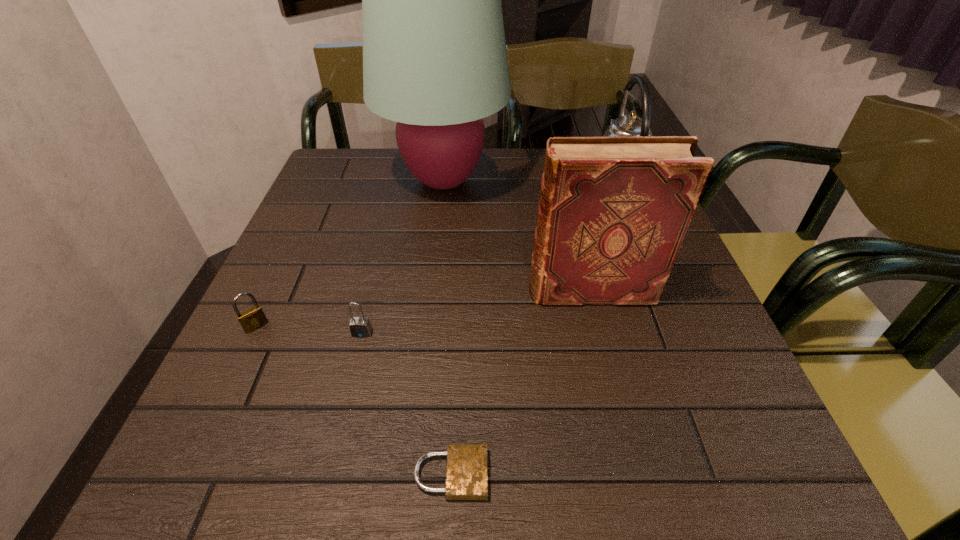
In order to click on padlock that is the nearest to the second padlock from right to left in this screenshot , I will do (254, 318).

Where is `padlock that is the closest to the kettle`? padlock that is the closest to the kettle is located at coordinates [360, 327].

In order to click on free space in the image that satisfies the following two spatial constraints: 1. on the spine side of the hardback book; 2. on the shackle of the second padlock from left to right in this screenshot , I will do `click(601, 333)`.

Where is `vacant space that satisfies the following two spatial constraints: 1. on the spine side of the hardback book; 2. on the shackle of the second padlock from right to left`? This screenshot has height=540, width=960. vacant space that satisfies the following two spatial constraints: 1. on the spine side of the hardback book; 2. on the shackle of the second padlock from right to left is located at coordinates (601, 333).